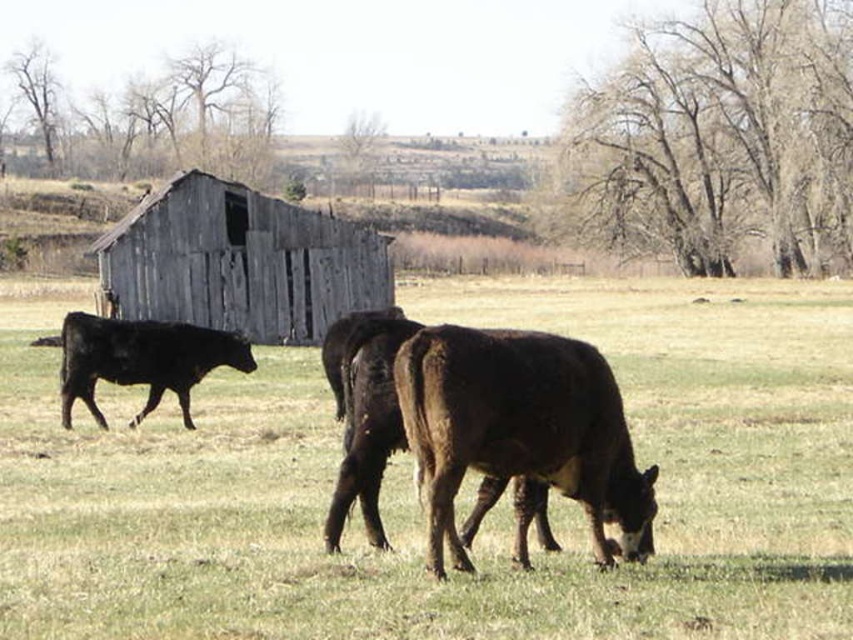
Which is behind, point (318, 237) or point (231, 346)?

Positioned behind is point (318, 237).

Who is higher up, weathered wood barn at upper left or black smooth cow at left?

weathered wood barn at upper left is above.

Locate an element on the screen. weathered wood barn at upper left is located at coordinates (239, 262).

Who is positioned more to the left, brown rough textured bull at center or black smooth cow at left?

black smooth cow at left

In the scene shown: Is the position of brown rough textured bull at center less distant than that of black smooth cow at left?

Yes, it is.

The image size is (853, 640). I want to click on brown rough textured bull at center, so click(519, 432).

Between green grass at center and black smooth cow at left, which one is positioned higher?

Positioned higher is black smooth cow at left.

Is green grass at center wider than black smooth cow at left?

Indeed, green grass at center has a greater width compared to black smooth cow at left.

What are the coordinates of `green grass at center` in the screenshot? It's located at (413, 492).

What are the coordinates of `green grass at center` in the screenshot? It's located at (413, 492).